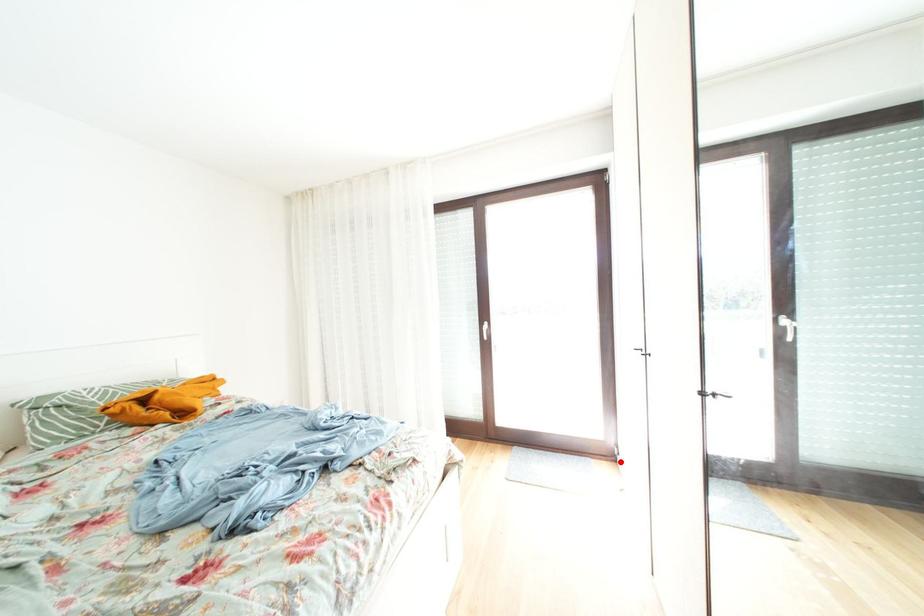
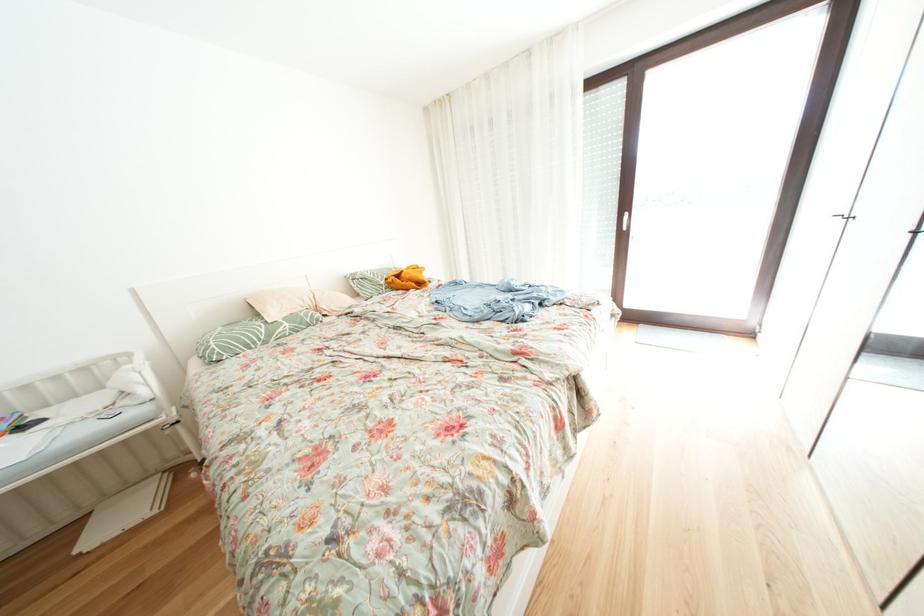
Question: I am providing you with two images of the same scene from different viewpoints. A red point is marked on the first image. Can you still see the location of the red point in image 2?

Choices:
 (A) Yes
 (B) No

Answer: (A)